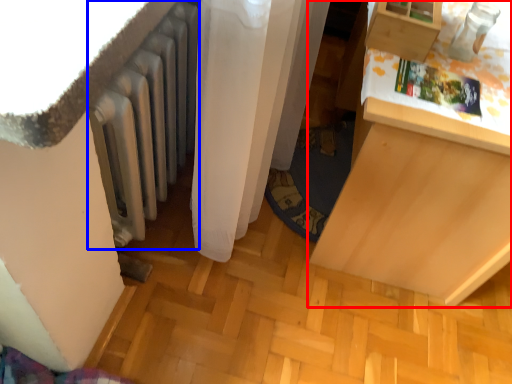
Question: Which object is closer to the camera taking this photo, furniture (highlighted by a red box) or radiator (highlighted by a blue box)?

Choices:
 (A) furniture
 (B) radiator

Answer: (B)